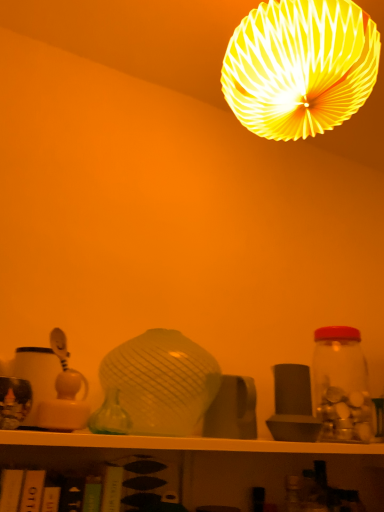
Question: Is transparent glass jar at right thinner than green glass vase at center?

Choices:
 (A) no
 (B) yes

Answer: (A)

Question: Would you consider transparent glass jar at right to be distant from green glass vase at center?

Choices:
 (A) yes
 (B) no

Answer: (B)

Question: Does transparent glass jar at right have a larger size compared to green glass vase at center?

Choices:
 (A) no
 (B) yes

Answer: (B)

Question: From a real-world perspective, is transparent glass jar at right over green glass vase at center?

Choices:
 (A) yes
 (B) no

Answer: (A)

Question: Considering the relative sizes of transparent glass jar at right and green glass vase at center in the image provided, is transparent glass jar at right smaller than green glass vase at center?

Choices:
 (A) yes
 (B) no

Answer: (B)

Question: Is transparent glass jar at right wider than green glass vase at center?

Choices:
 (A) no
 (B) yes

Answer: (B)

Question: From the image's perspective, is green glass vase at center below yellow paper lampshade at upper center?

Choices:
 (A) yes
 (B) no

Answer: (A)

Question: From the image's perspective, is green glass vase at center on yellow paper lampshade at upper center?

Choices:
 (A) yes
 (B) no

Answer: (B)

Question: Is green glass vase at center bigger than yellow paper lampshade at upper center?

Choices:
 (A) no
 (B) yes

Answer: (A)

Question: Is green glass vase at center facing away from yellow paper lampshade at upper center?

Choices:
 (A) no
 (B) yes

Answer: (A)

Question: Can you confirm if green glass vase at center is positioned to the right of yellow paper lampshade at upper center?

Choices:
 (A) no
 (B) yes

Answer: (A)

Question: Is yellow paper lampshade at upper center surrounded by green glass vase at center?

Choices:
 (A) no
 (B) yes

Answer: (A)

Question: Is yellow paper lampshade at upper center in front of matte yellow plastic toy at left?

Choices:
 (A) yes
 (B) no

Answer: (A)